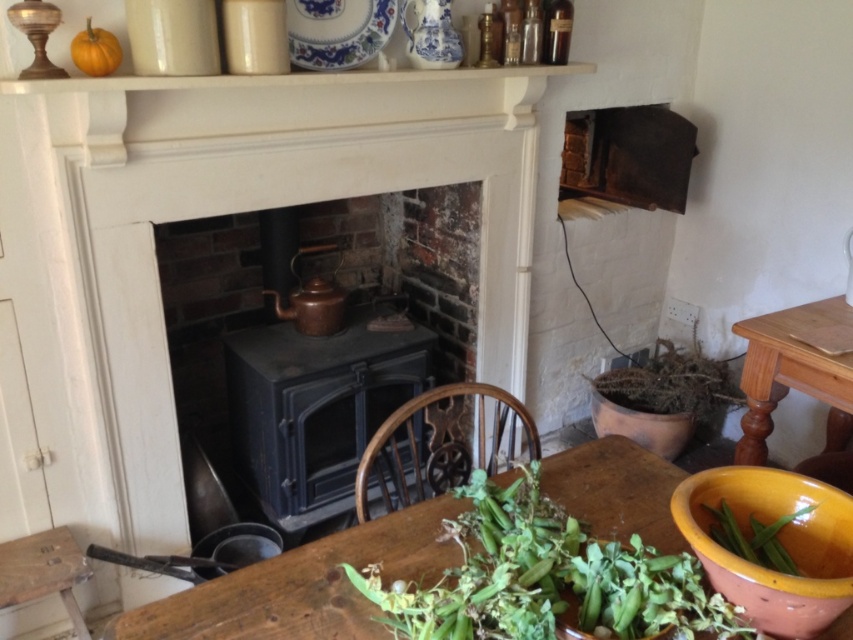
You are setting up a table for a cozy dinner. You have a blue and white porcelain plate at upper center and an orange matte pumpkin at upper left. Where should you place the centerpiece to ensure it is between these two items?

The centerpiece should be placed between the blue and white porcelain plate at upper center and the orange matte pumpkin at upper left, since the plate is above the pumpkin.

You are a chef preparing a meal and need to access both the green leafy vegetable at lower center and the green leafy vegetable at lower right on the wooden table in front of the fireplace. Which vegetable is closer to you?

The green leafy vegetable at lower center is closer to you since it is positioned in front of the green leafy vegetable at lower right.

You are a chef standing in the kitchen and want to reach the blue and white porcelain plate at upper center to place a freshly baked pie. Can you estimate if you can comfortably reach it without needing a stool?

The blue and white porcelain plate at upper center is 1.78 meters away from the viewer. Assuming an average adult arm reach of about 1.5 to 1.7 meters, the chef might need a small stool to comfortably reach it.